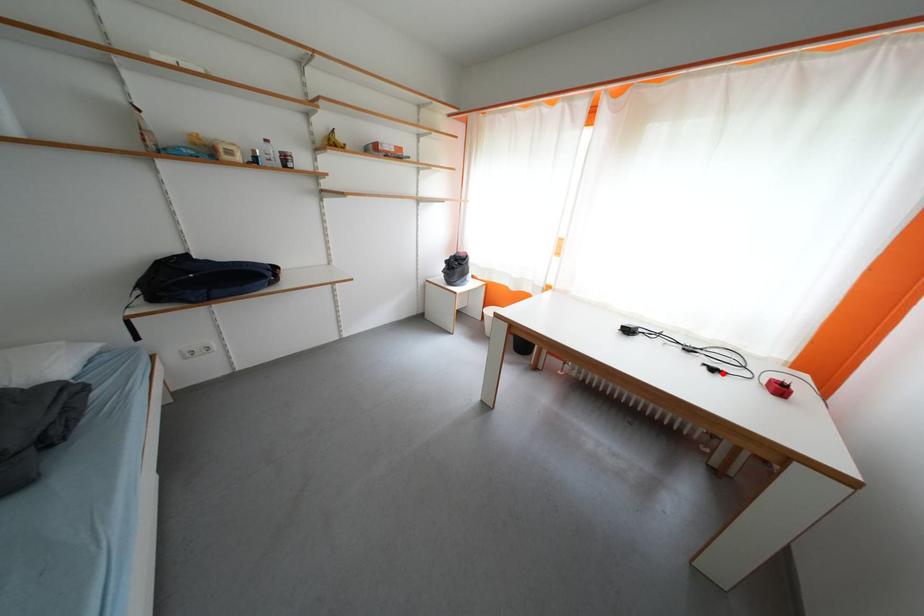
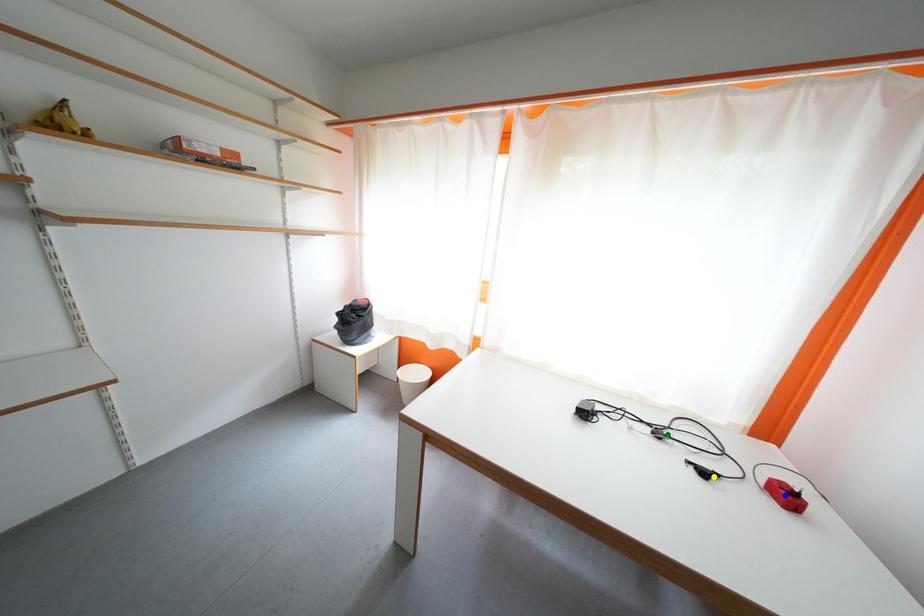
Question: I am providing you with two images of the same scene from different viewpoints. A red point is marked on the first image. You are given multiple points on the second image. Which mark in image 2 goes with the point in image 1?

Choices:
 (A) yellow point
 (B) green point
 (C) blue point

Answer: (A)